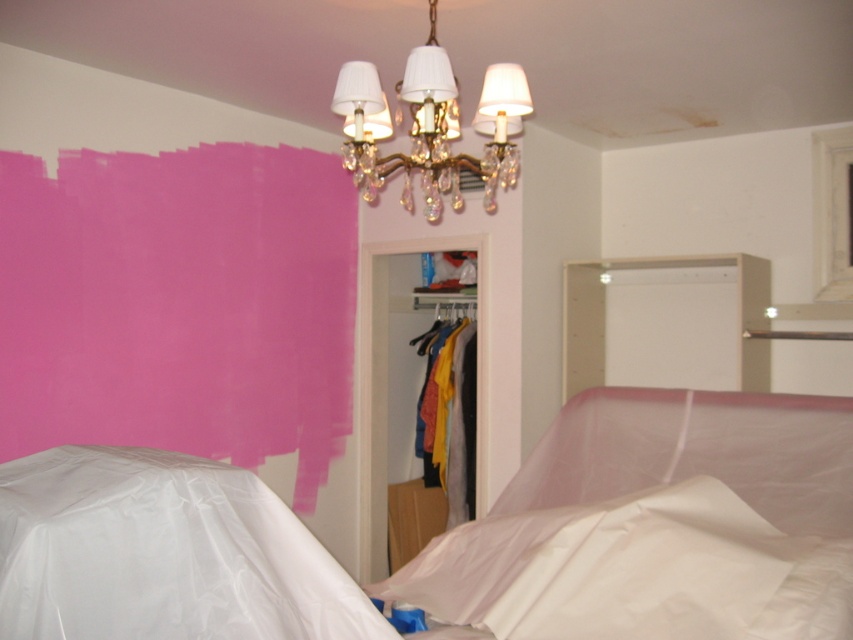
Question: Is white plastic bed at lower left below matte plastic clothes at center?

Choices:
 (A) no
 (B) yes

Answer: (B)

Question: Is white matte plastic sheet at lower center wider than matte plastic clothes at center?

Choices:
 (A) no
 (B) yes

Answer: (B)

Question: Is white plastic sheet at lower left bigger than white matte plastic sheet at lower center?

Choices:
 (A) no
 (B) yes

Answer: (A)

Question: Which point is farther to the camera?

Choices:
 (A) white matte plastic sheet at lower center
 (B) white plastic bed at lower left
 (C) matte plastic clothes at center
 (D) gold crystal chandelier at upper center

Answer: (C)

Question: Estimate the real-world distances between objects in this image. Which object is farther from the white matte plastic sheet at lower center?

Choices:
 (A) matte plastic clothes at center
 (B) white plastic bed at lower left
 (C) white plastic sheet at lower left

Answer: (A)

Question: Estimate the real-world distances between objects in this image. Which object is closer to the white plastic sheet at lower left?

Choices:
 (A) gold crystal chandelier at upper center
 (B) white matte plastic sheet at lower center

Answer: (B)